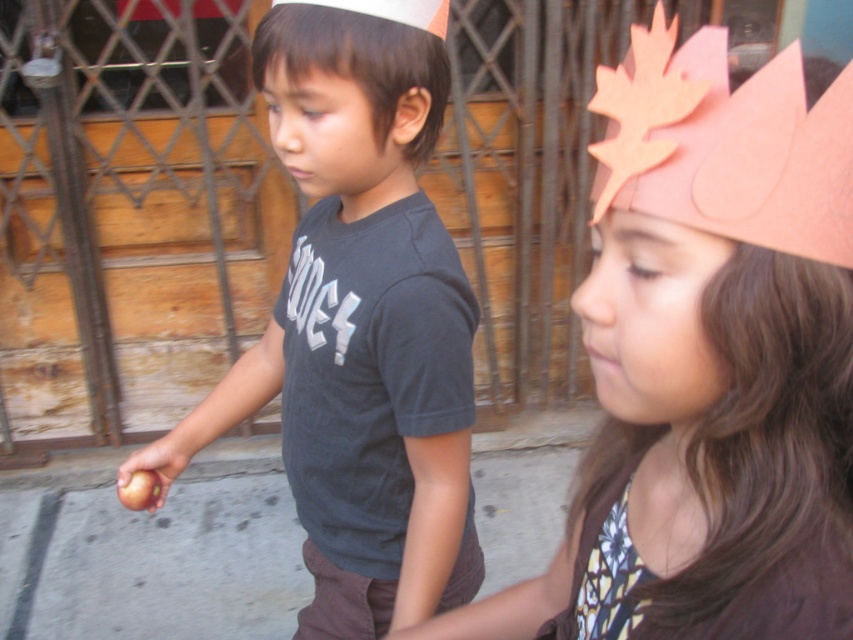
Question: Is pink paper headdress at upper right smaller than pink cardboard maple leaf at upper right?

Choices:
 (A) yes
 (B) no

Answer: (A)

Question: Which of the following is the farthest from the observer?

Choices:
 (A) (840, 108)
 (B) (285, 13)
 (C) (807, 451)
 (D) (265, 342)

Answer: (D)

Question: Does pink paper headdress at upper right appear on the left side of pink cardboard maple leaf at upper right?

Choices:
 (A) no
 (B) yes

Answer: (B)

Question: Is matte black shirt at left thinner than pink cardboard maple leaf at upper right?

Choices:
 (A) yes
 (B) no

Answer: (B)

Question: Considering the real-world distances, which object is closest to the pink paper crown at upper right?

Choices:
 (A) matte black shirt at left
 (B) pink cardboard maple leaf at upper right
 (C) matte black shirt at center

Answer: (B)

Question: Among these objects, which one is farthest from the camera?

Choices:
 (A) matte black shirt at left
 (B) pink paper headdress at upper right
 (C) matte black shirt at center

Answer: (C)